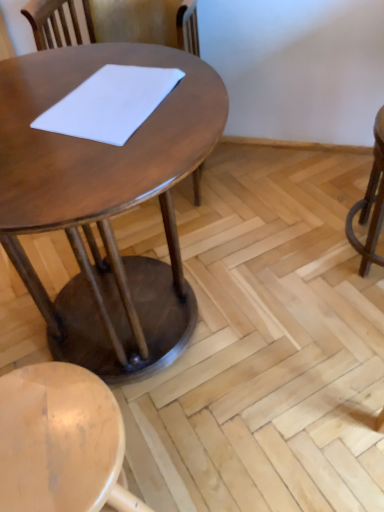
Question: Can you confirm if shiny brown table at center is wider than light wood stool at lower left?

Choices:
 (A) no
 (B) yes

Answer: (B)

Question: Does shiny brown table at center have a greater height compared to light wood stool at lower left?

Choices:
 (A) yes
 (B) no

Answer: (A)

Question: Is light wood stool at lower left surrounded by shiny brown table at center?

Choices:
 (A) no
 (B) yes

Answer: (A)

Question: Is shiny brown table at center aimed at light wood stool at lower left?

Choices:
 (A) yes
 (B) no

Answer: (A)

Question: Can you confirm if shiny brown table at center is bigger than light wood stool at lower left?

Choices:
 (A) no
 (B) yes

Answer: (B)

Question: Considering the positions of light wood stool at lower left and white matte notepad at center in the image, is light wood stool at lower left bigger or smaller than white matte notepad at center?

Choices:
 (A) big
 (B) small

Answer: (A)

Question: Considering their positions, is light wood stool at lower left located in front of or behind white matte notepad at center?

Choices:
 (A) behind
 (B) front

Answer: (B)

Question: From a real-world perspective, is light wood stool at lower left above or below white matte notepad at center?

Choices:
 (A) below
 (B) above

Answer: (A)

Question: Visually, is light wood stool at lower left positioned to the left or to the right of white matte notepad at center?

Choices:
 (A) right
 (B) left

Answer: (B)

Question: Would you say white matte notepad at center is inside or outside light wood stool at lower left?

Choices:
 (A) inside
 (B) outside

Answer: (B)

Question: In terms of width, does white matte notepad at center look wider or thinner when compared to light wood stool at lower left?

Choices:
 (A) thin
 (B) wide

Answer: (A)

Question: Considering the relative positions of white matte notepad at center and light wood stool at lower left in the image provided, is white matte notepad at center to the left or to the right of light wood stool at lower left?

Choices:
 (A) right
 (B) left

Answer: (A)

Question: Does point (127, 131) appear closer or farther from the camera than point (16, 492)?

Choices:
 (A) farther
 (B) closer

Answer: (A)

Question: In terms of size, does white matte notepad at center appear bigger or smaller than shiny brown table at center?

Choices:
 (A) big
 (B) small

Answer: (B)

Question: Looking at their shapes, would you say white matte notepad at center is wider or thinner than shiny brown table at center?

Choices:
 (A) thin
 (B) wide

Answer: (A)